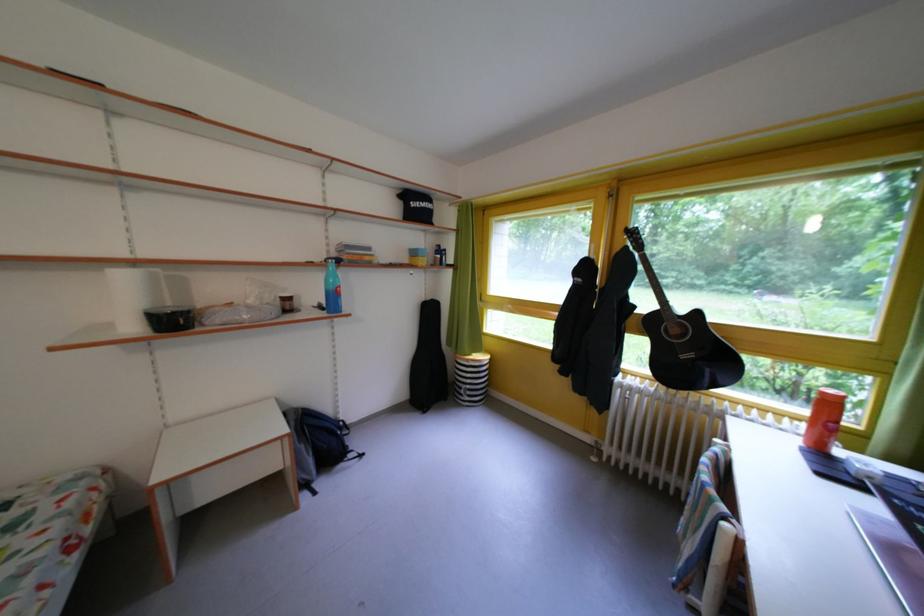
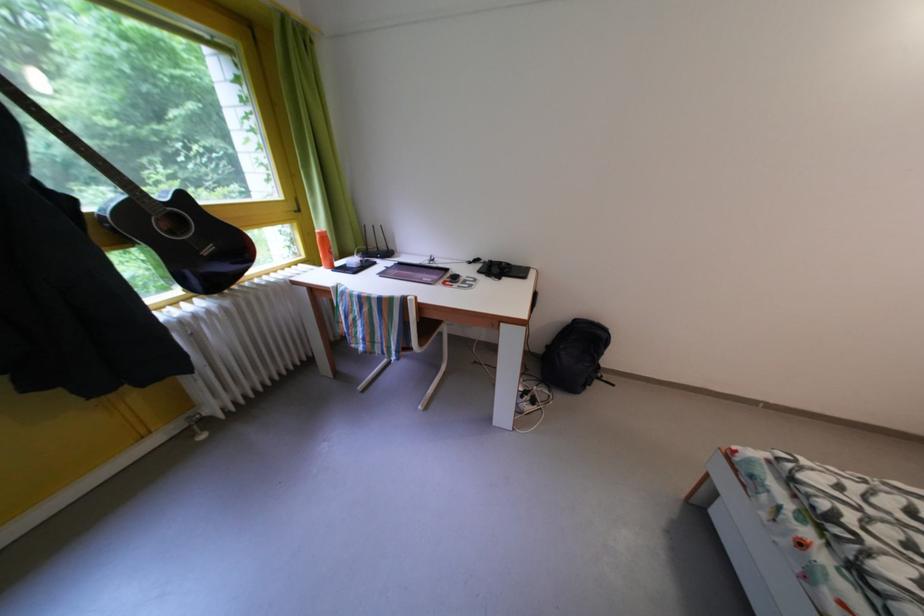
The point at (833, 399) is marked in the first image. Where is the corresponding point in the second image?

(329, 238)